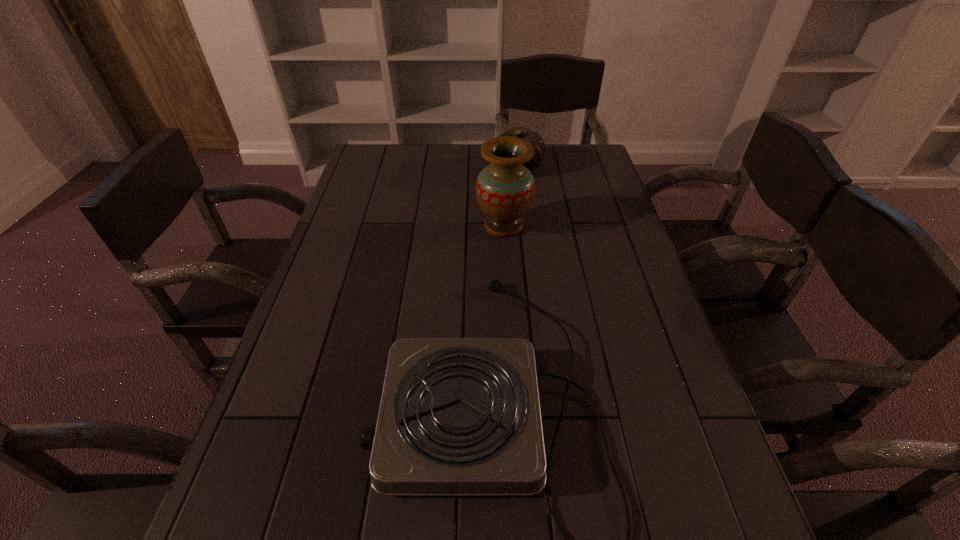
The width and height of the screenshot is (960, 540). What are the coordinates of `the second farthest object` in the screenshot? It's located at (505, 189).

The width and height of the screenshot is (960, 540). Identify the location of the tallest object. pos(505,189).

You are a GUI agent. You are given a task and a screenshot of the screen. Output one action in this format:
    pyautogui.click(x=<x>, y=<y>)
    Task: Click on the gourd
    The height and width of the screenshot is (540, 960).
    Given the screenshot: What is the action you would take?
    pyautogui.click(x=534, y=138)

You are a GUI agent. You are given a task and a screenshot of the screen. Output one action in this format:
    pyautogui.click(x=<x>, y=<y>)
    Task: Click on the second shortest object
    
    Given the screenshot: What is the action you would take?
    click(x=534, y=138)

Where is `free space located 0.180m on the back of the second nearest object`? The height and width of the screenshot is (540, 960). free space located 0.180m on the back of the second nearest object is located at coordinates (501, 178).

Where is `vacant space situated 0.360m on the left of the gourd`? vacant space situated 0.360m on the left of the gourd is located at coordinates (386, 167).

Image resolution: width=960 pixels, height=540 pixels. Identify the location of object positioned at the far edge. pos(534,138).

Identify the location of vacant space at the far edge. (430, 153).

Identify the location of vacant space at the left edge of the desktop. The height and width of the screenshot is (540, 960). (389, 191).

You are a GUI agent. You are given a task and a screenshot of the screen. Output one action in this format:
    pyautogui.click(x=<x>, y=<y>)
    Task: Click on the vacant space at the right edge
    This screenshot has width=960, height=540.
    Given the screenshot: What is the action you would take?
    pyautogui.click(x=638, y=414)